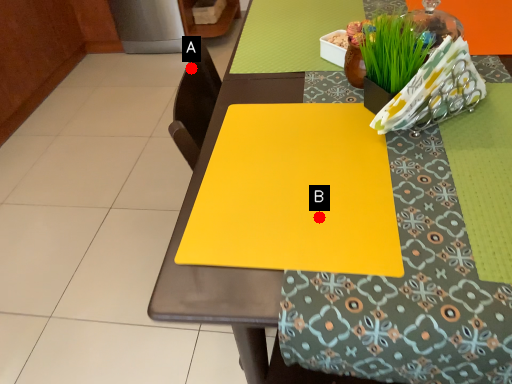
Question: Two points are circled on the image, labeled by A and B beside each circle. Which point appears farthest from the camera in this image?

Choices:
 (A) A is further
 (B) B is further

Answer: (A)